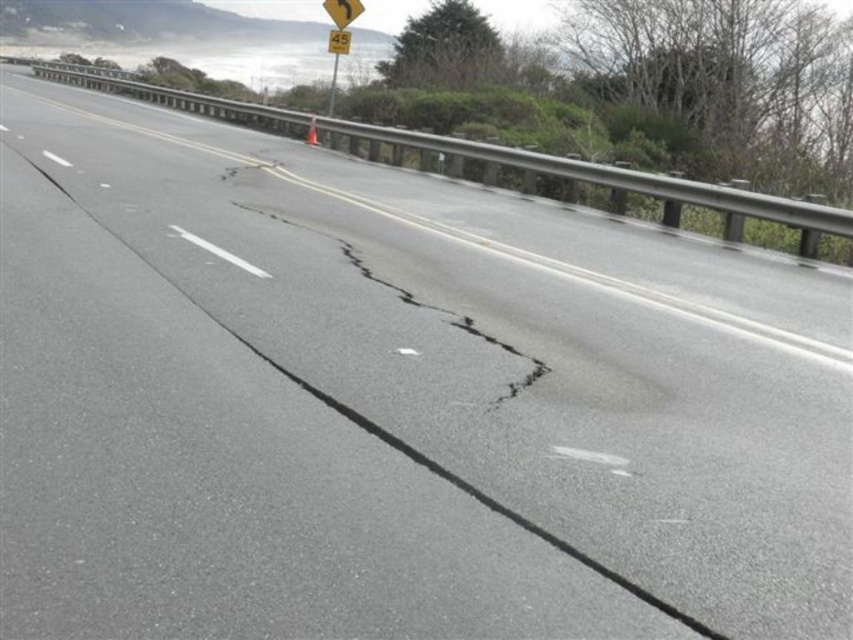
Between point (361, 12) and point (337, 42), which one is positioned in front?

Point (361, 12) is more forward.

Does yellow matte sign at upper center have a greater width compared to yellow plastic sign at upper center?

No.

The image size is (853, 640). Identify the location of yellow matte sign at upper center. (341, 10).

Where is `yellow matte sign at upper center`? yellow matte sign at upper center is located at coordinates (341, 10).

Is black asphalt crack at center thinner than yellow matte sign at upper center?

No.

Is the position of black asphalt crack at center more distant than that of yellow matte sign at upper center?

That is False.

Who is more distant from viewer, (405, 365) or (326, 4)?

Point (326, 4)

At what (x,y) coordinates should I click in order to perform the action: click on black asphalt crack at center. Please return your answer as a coordinate pair (x, y). The image size is (853, 640). Looking at the image, I should click on coord(372,328).

Does black asphalt crack at center appear on the right side of yellow plastic sign at upper center?

Correct, you'll find black asphalt crack at center to the right of yellow plastic sign at upper center.

Is point (291, 282) closer to camera compared to point (340, 51)?

Yes, point (291, 282) is in front of point (340, 51).

Does point (308, 273) lie in front of point (341, 29)?

That is True.

Locate an element on the screen. This screenshot has height=640, width=853. black asphalt crack at center is located at coordinates (372, 328).